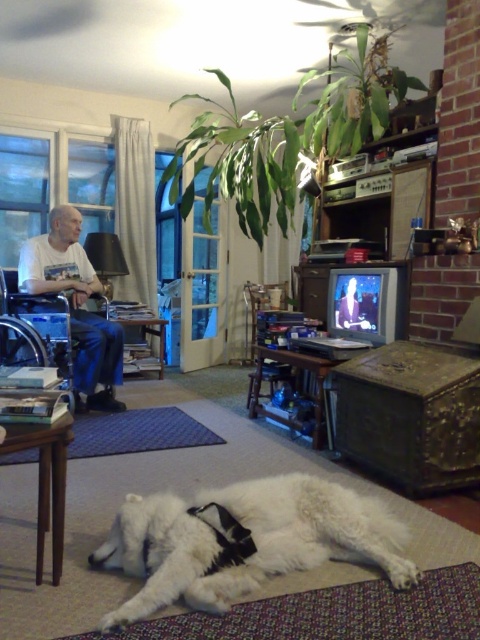
Question: Does white fluffy dog at lower center appear on the right side of white cotton shirt at left?

Choices:
 (A) no
 (B) yes

Answer: (B)

Question: Observing the image, what is the correct spatial positioning of white fluffy dog at lower center in reference to white cotton shirt at left?

Choices:
 (A) right
 (B) left

Answer: (A)

Question: Which object is farther from the camera taking this photo?

Choices:
 (A) white cotton shirt at left
 (B) white fluffy dog at lower center

Answer: (A)

Question: Can you confirm if white fluffy dog at lower center is wider than white cotton shirt at left?

Choices:
 (A) no
 (B) yes

Answer: (B)

Question: Which point is closer to the camera?

Choices:
 (A) white cotton shirt at left
 (B) white fluffy dog at lower center

Answer: (B)